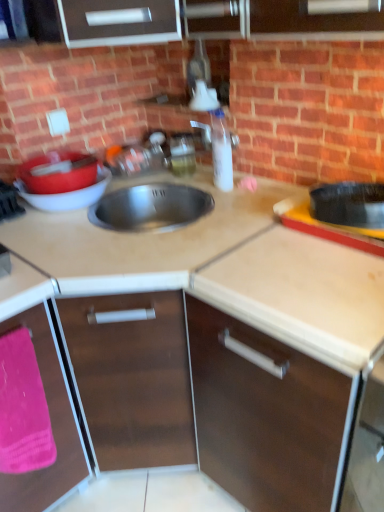
Question: Should I look upward or downward to see clear plastic bottle at center?

Choices:
 (A) down
 (B) up

Answer: (B)

Question: From the image's perspective, is clear plastic bottle at center above matte red basin at left?

Choices:
 (A) yes
 (B) no

Answer: (A)

Question: From a real-world perspective, is clear plastic bottle at center under matte red basin at left?

Choices:
 (A) yes
 (B) no

Answer: (B)

Question: Can you confirm if clear plastic bottle at center is bigger than matte red basin at left?

Choices:
 (A) no
 (B) yes

Answer: (A)

Question: From the image's perspective, is clear plastic bottle at center below matte red basin at left?

Choices:
 (A) yes
 (B) no

Answer: (B)

Question: Can you confirm if clear plastic bottle at center is taller than matte red basin at left?

Choices:
 (A) no
 (B) yes

Answer: (B)

Question: Is clear plastic bottle at center at the right side of matte red basin at left?

Choices:
 (A) no
 (B) yes

Answer: (B)

Question: Is the position of translucent plastic soap dispenser at upper center more distant than that of beige laminate countertop at center, the first countertop in the bottom-to-top sequence?

Choices:
 (A) yes
 (B) no

Answer: (A)

Question: From the image's perspective, is translucent plastic soap dispenser at upper center located above beige laminate countertop at center, the first countertop in the bottom-to-top sequence?

Choices:
 (A) yes
 (B) no

Answer: (A)

Question: Considering the relative positions of translucent plastic soap dispenser at upper center and beige laminate countertop at center, the first countertop in the bottom-to-top sequence, in the image provided, is translucent plastic soap dispenser at upper center to the right of beige laminate countertop at center, the first countertop in the bottom-to-top sequence, from the viewer's perspective?

Choices:
 (A) no
 (B) yes

Answer: (B)

Question: From the image's perspective, is translucent plastic soap dispenser at upper center below beige laminate countertop at center, arranged as the second countertop when viewed from the top?

Choices:
 (A) yes
 (B) no

Answer: (B)

Question: Is the depth of translucent plastic soap dispenser at upper center less than that of beige laminate countertop at center, the first countertop in the bottom-to-top sequence?

Choices:
 (A) yes
 (B) no

Answer: (B)

Question: From a real-world perspective, is translucent plastic soap dispenser at upper center beneath beige laminate countertop at center, the first countertop in the bottom-to-top sequence?

Choices:
 (A) no
 (B) yes

Answer: (A)

Question: Is pink fabric at lower left taller than brown matte cabinet at lower left, the 2th cabinetry positioned from the right?

Choices:
 (A) yes
 (B) no

Answer: (B)